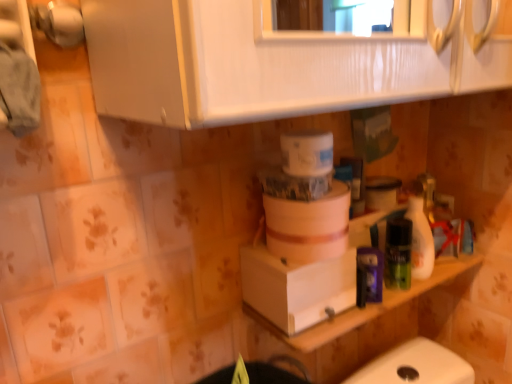
Question: Based on their sizes in the image, would you say white glossy bottle at right is bigger or smaller than white matte container at center?

Choices:
 (A) big
 (B) small

Answer: (B)

Question: In the image, is white glossy bottle at right positioned in front of or behind white matte container at center?

Choices:
 (A) front
 (B) behind

Answer: (B)

Question: Which object is positioned closest to the white glossy bottle at right?

Choices:
 (A) white matte counter top at lower right
 (B) white matte container at center
 (C) white cardboard box at center

Answer: (A)

Question: Which of these objects is positioned closest to the white glossy bottle at right?

Choices:
 (A) white cardboard box at center
 (B) white matte container at center
 (C) white matte counter top at lower right

Answer: (C)